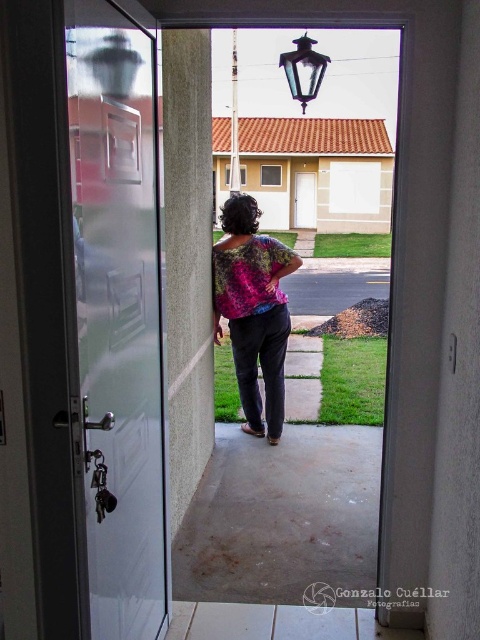
Based on the photo, you are standing inside the house and want to exit through the frosted glass door at left. Based on its position coordinates, can you determine if the door is on the left side of the room or the right side?

The frosted glass door at left is positioned at coordinates point (119, 314), which places it on the left side of the room.

Consider the image. You are standing inside a house and want to exit through the door that leads to the porch. The frosted glass door at left and the white glossy door at center are both visible. Which door should you choose to exit to the porch?

You should choose the frosted glass door at left because it is the one leading to the porch, as the white glossy door at center is positioned above it and likely part of an upper structure like a window or another entrance.